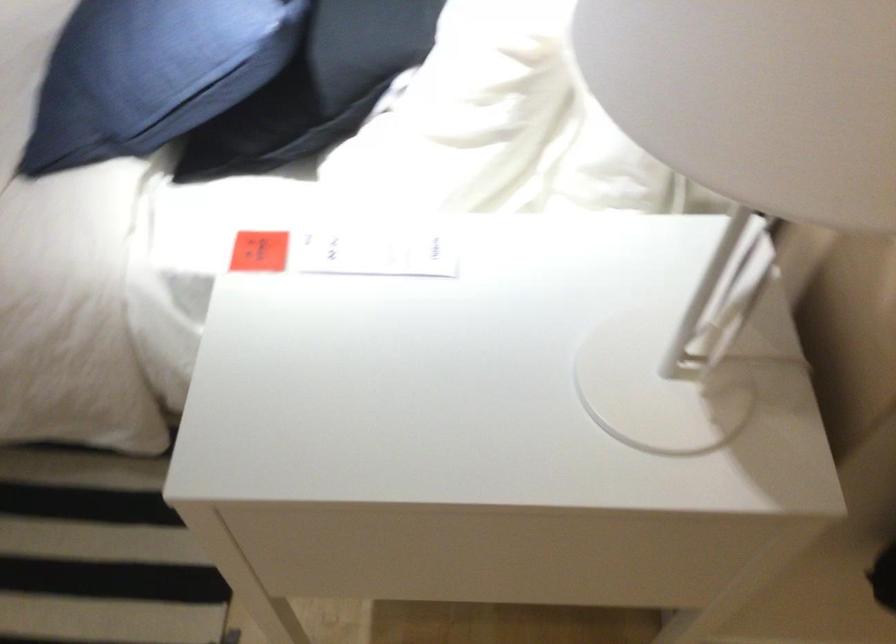
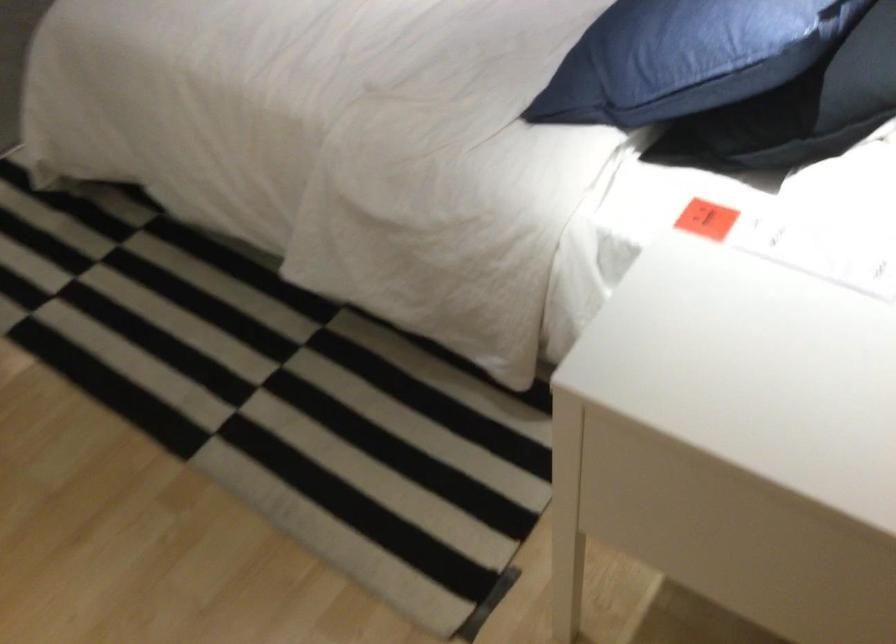
Question: The camera is either moving clockwise (left) or counter-clockwise (right) around the object. The first image is from the beginning of the video and the second image is from the end. Is the camera moving left or right when shooting the video?

Choices:
 (A) Left
 (B) Right

Answer: (B)